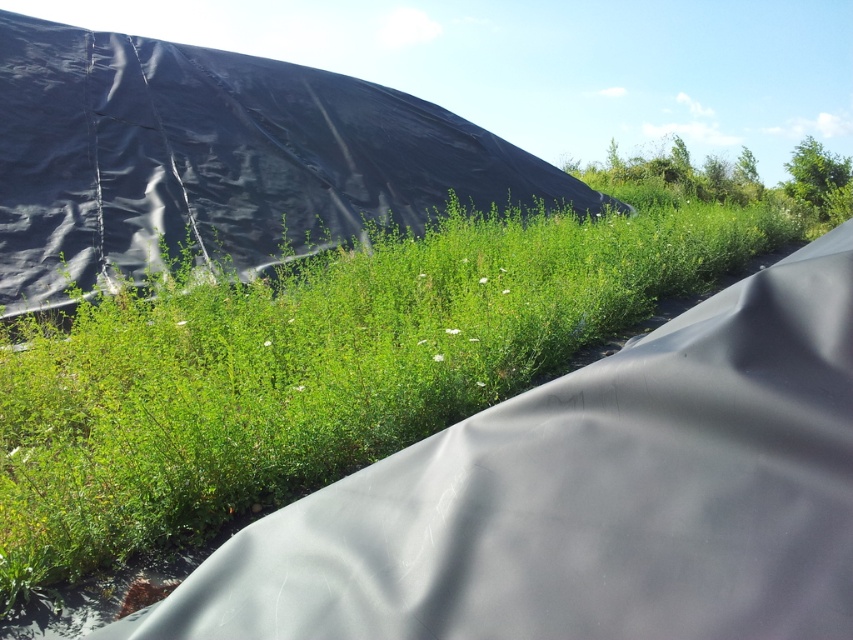
You are a gardener who wants to plant flowers in the green matte grass at center. However, you need to walk from the edge of the scene to reach it. Is the black tarp at upper left blocking your path?

The green matte grass at center is in front of the black tarp at upper left, so the black tarp at upper left is behind the grass. Therefore, the black tarp at upper left is not blocking your path to the green matte grass at center.